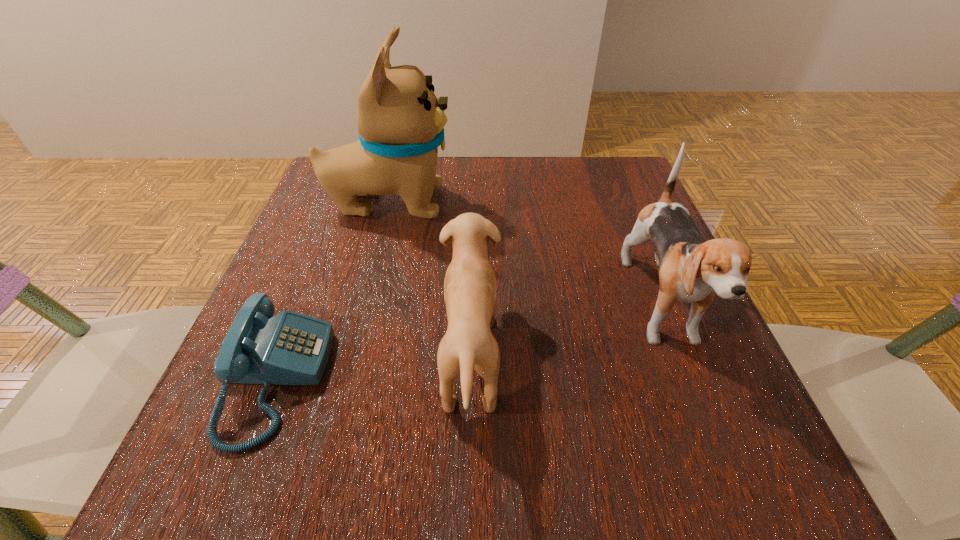
In the image, there is a desktop. At what (x,y) coordinates should I click in order to perform the action: click on vacant region at the left edge. Please return your answer as a coordinate pair (x, y). Image resolution: width=960 pixels, height=540 pixels. Looking at the image, I should click on (320, 423).

This screenshot has height=540, width=960. In the image, there is a desktop. Identify the location of free region at the right edge. point(718,398).

You are a GUI agent. You are given a task and a screenshot of the screen. Output one action in this format:
    pyautogui.click(x=<x>, y=<y>)
    Task: Click on the vacant space at the far right corner of the desktop
    This screenshot has height=540, width=960.
    Given the screenshot: What is the action you would take?
    pyautogui.click(x=644, y=196)

Image resolution: width=960 pixels, height=540 pixels. Find the location of `unoccupied area between the shortest object and the tallest object`. unoccupied area between the shortest object and the tallest object is located at coordinates (330, 292).

Find the location of `vacant space that's between the shortest object and the tallest puppy`. vacant space that's between the shortest object and the tallest puppy is located at coordinates (x=330, y=292).

This screenshot has height=540, width=960. What are the coordinates of `vacant space that is in between the second shortest object and the telephone` in the screenshot? It's located at (372, 369).

Where is `vacant space in between the shortest object and the tallest object`? The width and height of the screenshot is (960, 540). vacant space in between the shortest object and the tallest object is located at coordinates (330, 292).

At what (x,y) coordinates should I click in order to perform the action: click on vacant point located between the shortest puppy and the shortest object. Please return your answer as a coordinate pair (x, y). Looking at the image, I should click on (372, 369).

Locate an element on the screen. The height and width of the screenshot is (540, 960). vacant region between the farthest object and the shortest puppy is located at coordinates point(429,280).

Where is `free space between the tallest puppy and the telephone`? This screenshot has width=960, height=540. free space between the tallest puppy and the telephone is located at coordinates (330, 292).